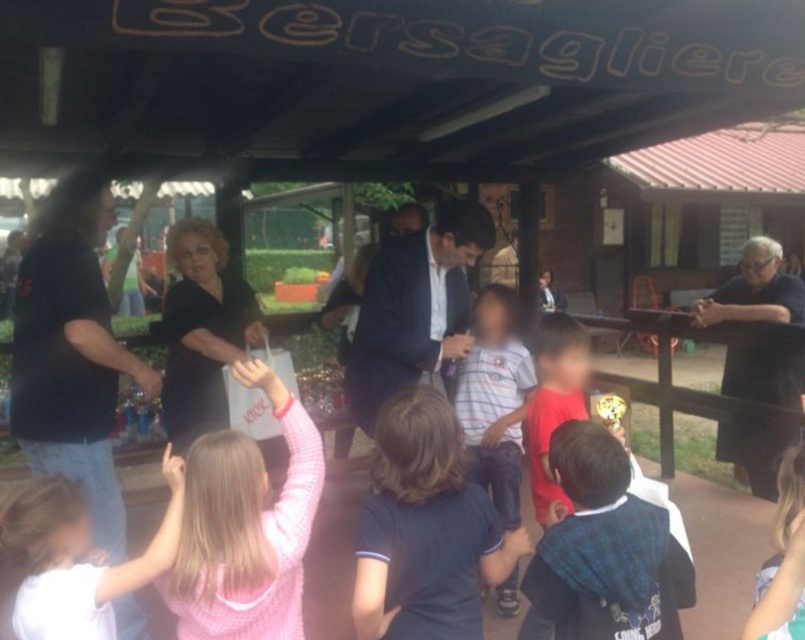
You are a photographer trying to capture a group photo of the black matte shirt at left and the pink fleece sweater at lower left. Based on their heights, which one should you position closer to the camera to ensure both are visible in the frame?

The black matte shirt at left is taller than the pink fleece sweater at lower left. To ensure both are visible in the frame, position the black matte shirt at left slightly further back and the pink fleece sweater at lower left closer to the camera.

You are a photographer trying to capture a group photo of the dark blue textured shirt at center and the black fabric at right. Since you want both subjects to be in focus, which one should you adjust your camera focus on first to ensure clarity?

The dark blue textured shirt at center has a lesser height compared to black fabric at right, so you should focus on the dark blue textured shirt at center first as it is closer to the camera.